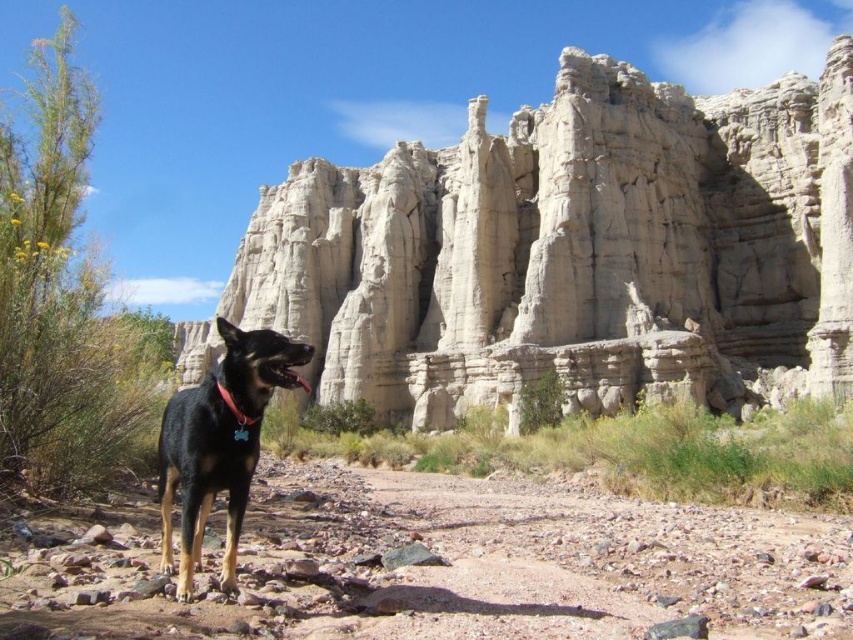
Between brown gravelly dirt track at center and black matte dog at center, which one appears on the left side from the viewer's perspective?

From the viewer's perspective, black matte dog at center appears more on the left side.

Locate an element on the screen. brown gravelly dirt track at center is located at coordinates (433, 564).

Between smooth sandstone rock formation at center and black matte dog at center, which one has less height?

black matte dog at center is shorter.

Does smooth sandstone rock formation at center appear over black matte dog at center?

Correct, smooth sandstone rock formation at center is located above black matte dog at center.

At what (x,y) coordinates should I click in order to perform the action: click on smooth sandstone rock formation at center. Please return your answer as a coordinate pair (x, y). The image size is (853, 640). Looking at the image, I should click on (573, 250).

Based on the photo, can you confirm if smooth sandstone rock formation at center is smaller than brown gravelly dirt track at center?

Incorrect, smooth sandstone rock formation at center is not smaller in size than brown gravelly dirt track at center.

The height and width of the screenshot is (640, 853). What are the coordinates of `smooth sandstone rock formation at center` in the screenshot? It's located at (573, 250).

At what (x,y) coordinates should I click in order to perform the action: click on smooth sandstone rock formation at center. Please return your answer as a coordinate pair (x, y). Looking at the image, I should click on (573, 250).